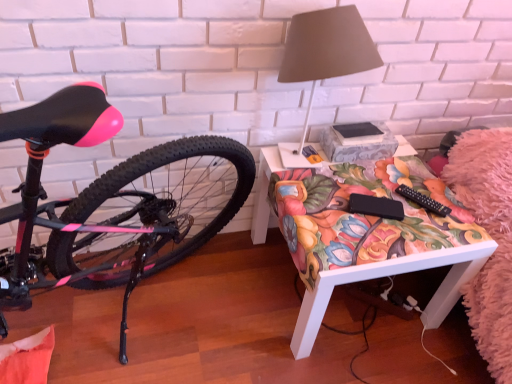
Image resolution: width=512 pixels, height=384 pixels. Identify the location of vacant space underneath matte gray lampshade at upper right (from a real-world perspective). (307, 170).